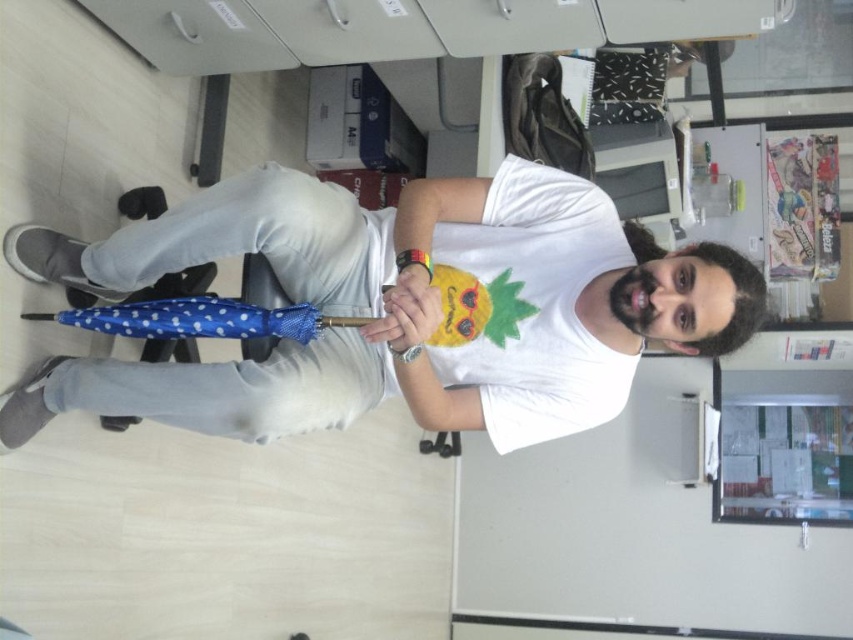
Question: Which point appears closest to the camera in this image?

Choices:
 (A) (471, 288)
 (B) (294, 312)

Answer: (B)

Question: Does blue polka dot umbrella at center appear on the left side of blue polka dot umbrella at lower left?

Choices:
 (A) yes
 (B) no

Answer: (B)

Question: Which of the following is the closest to the observer?

Choices:
 (A) (97, 406)
 (B) (154, 333)

Answer: (B)

Question: Is blue polka dot umbrella at center in front of blue polka dot umbrella at lower left?

Choices:
 (A) no
 (B) yes

Answer: (B)

Question: From the image, what is the correct spatial relationship of blue polka dot umbrella at center in relation to blue polka dot umbrella at lower left?

Choices:
 (A) above
 (B) below

Answer: (A)